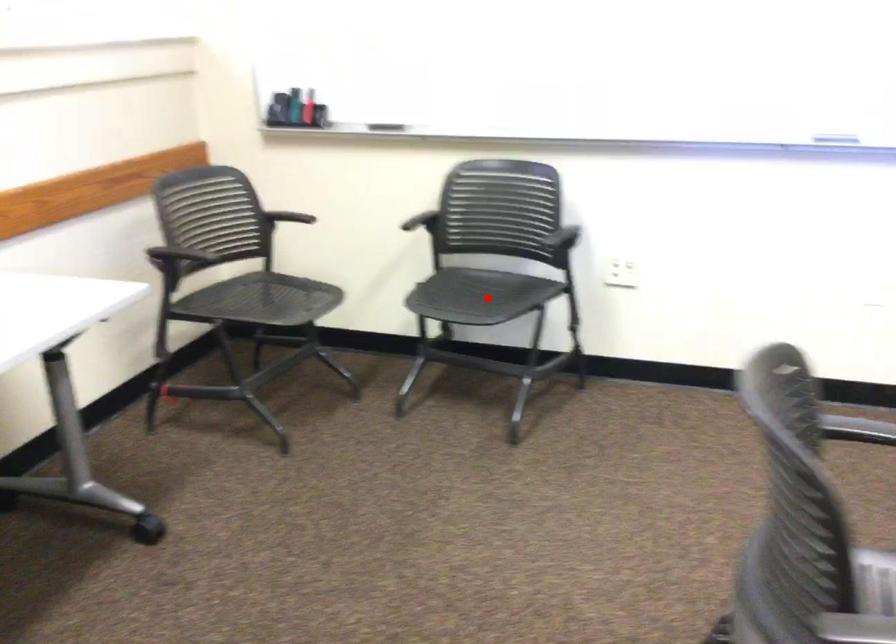
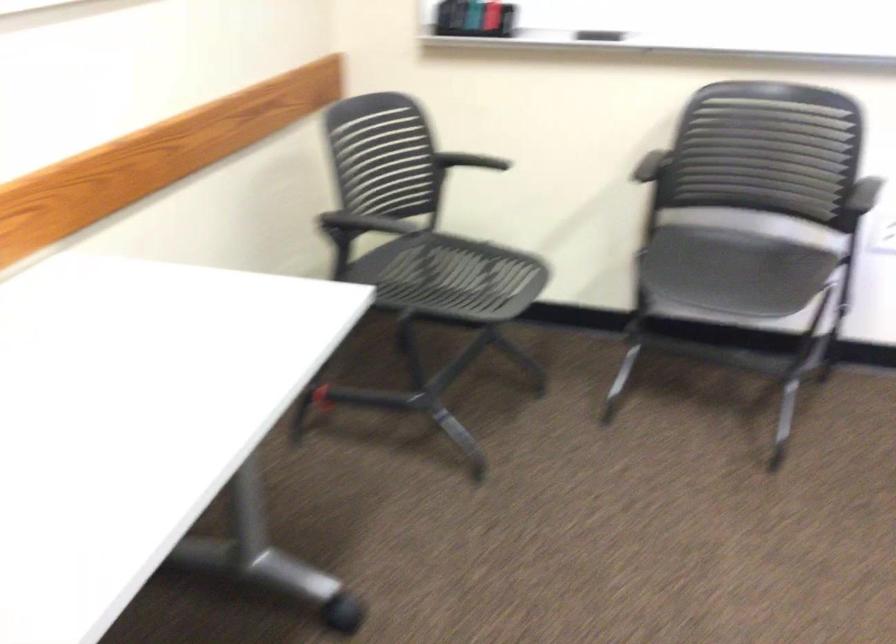
The point at the highlighted location is marked in the first image. Where is the corresponding point in the second image?

(731, 270)